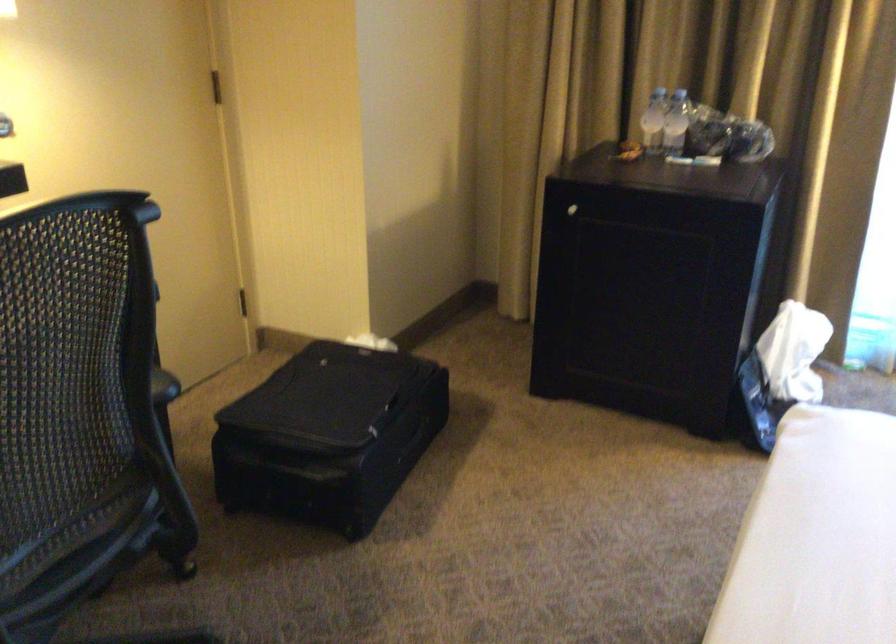
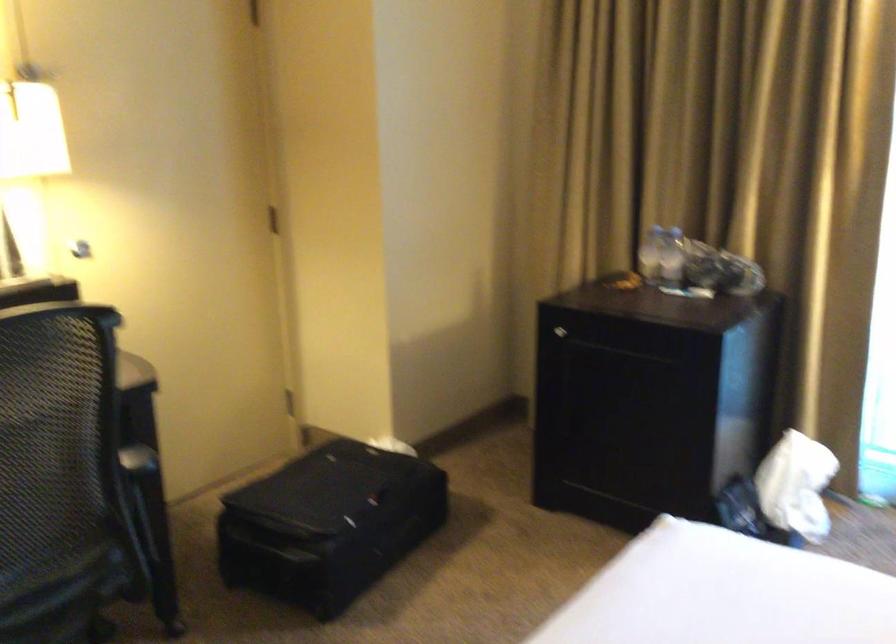
In the second image, find the point that corresponds to point 567,210 in the first image.

(560, 330)